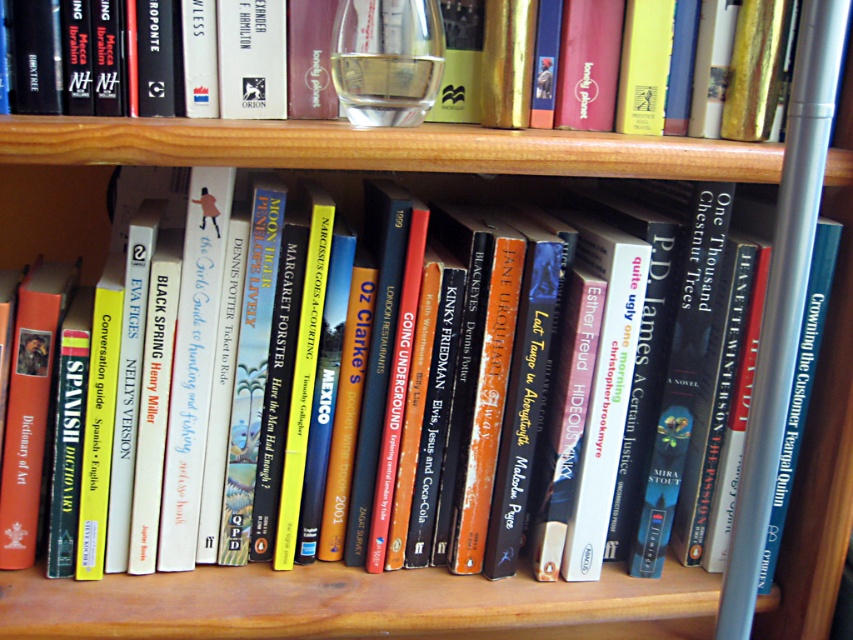
Between point (67, 76) and point (401, 93), which one is positioned behind?

The point (401, 93) is behind.

Does point (315, 64) lie in front of point (425, 48)?

No, (315, 64) is behind (425, 48).

Describe the element at coordinates (312, 65) in the screenshot. I see `gold hardcover book at upper center` at that location.

Identify the location of gold hardcover book at upper center. The height and width of the screenshot is (640, 853). (312, 65).